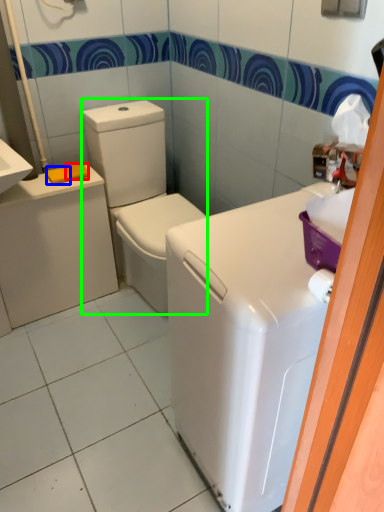
Question: Which object is positioned closest to soap (highlighted by a red box)? Select from soap (highlighted by a blue box) and washer (highlighted by a green box).

Choices:
 (A) soap
 (B) washer

Answer: (A)